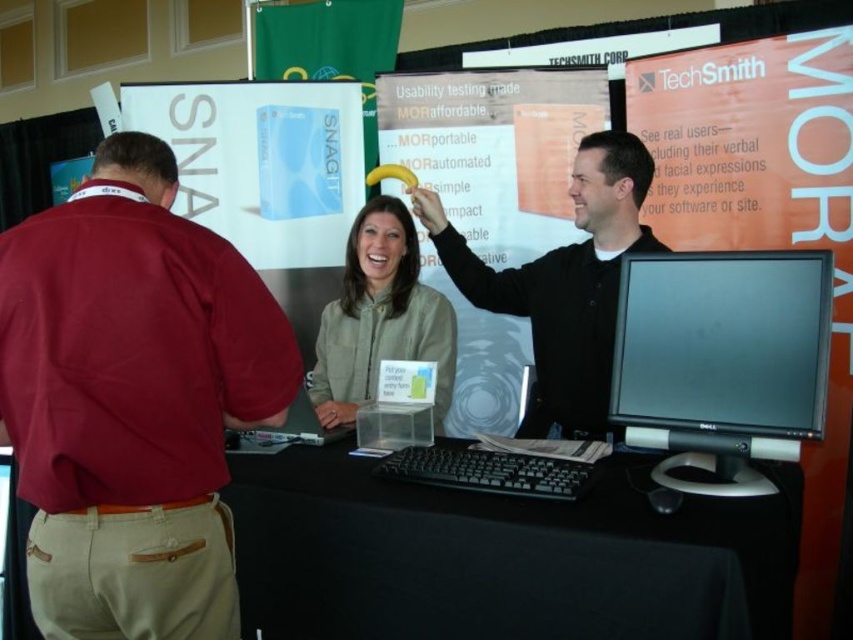
Question: Is black matte table at center wider than light brown leather jacket at center?

Choices:
 (A) yes
 (B) no

Answer: (A)

Question: Is black matte table at center smaller than light brown leather jacket at center?

Choices:
 (A) yes
 (B) no

Answer: (B)

Question: Which object appears farthest from the camera in this image?

Choices:
 (A) black matte table at center
 (B) black matte computer mouse at upper center

Answer: (B)

Question: Which of the following is the closest to the observer?

Choices:
 (A) (154, 497)
 (B) (676, 324)
 (C) (325, 355)
 (D) (529, 266)

Answer: (A)

Question: Which point is closer to the camera taking this photo?

Choices:
 (A) (602, 141)
 (B) (751, 468)
 (C) (292, 456)

Answer: (B)

Question: Is black matte table at center bigger than light brown leather jacket at center?

Choices:
 (A) no
 (B) yes

Answer: (B)